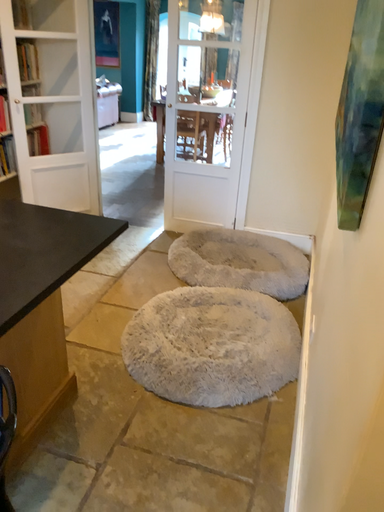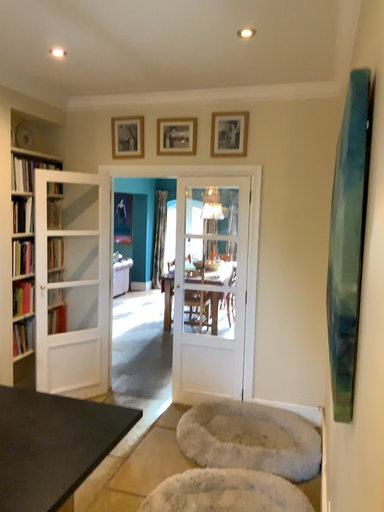
Question: Which way did the camera rotate in the video?

Choices:
 (A) rotated downward
 (B) rotated upward

Answer: (B)